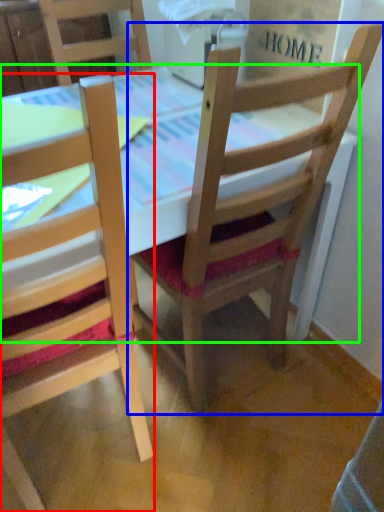
Question: Which object is positioned farthest from chair (highlighted by a red box)? Select from chair (highlighted by a blue box) and table (highlighted by a green box).

Choices:
 (A) chair
 (B) table

Answer: (B)